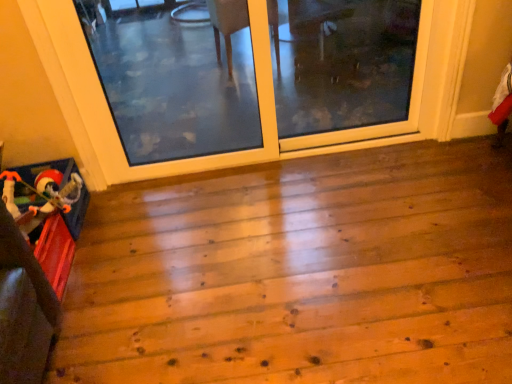
Describe the element at coordinates (23, 308) in the screenshot. I see `wooden toy at lower left` at that location.

Looking at this image, measure the distance between point (112, 179) and camera.

They are 7.84 feet apart.

Image resolution: width=512 pixels, height=384 pixels. In order to click on wooden toy at lower left in this screenshot , I will do `click(23, 308)`.

Is plush santa toy at lower left far from wooden toy at lower left?

That's not correct — plush santa toy at lower left is a little close to wooden toy at lower left.

From a real-world perspective, is plush santa toy at lower left physically located above or below wooden toy at lower left?

plush santa toy at lower left is above wooden toy at lower left.

How many degrees apart are the facing directions of plush santa toy at lower left and wooden toy at lower left?

0.47 degrees.

Can you confirm if plush santa toy at lower left is thinner than wooden toy at lower left?

No, plush santa toy at lower left is not thinner than wooden toy at lower left.

Is clear glass screen door at center, the 1th screen door when ordered from left to right, to the left of plush santa toy at lower left from the viewer's perspective?

Incorrect, clear glass screen door at center, the 1th screen door when ordered from left to right, is not on the left side of plush santa toy at lower left.

Based on the photo, is clear glass screen door at center, the 1th screen door when ordered from left to right, oriented towards plush santa toy at lower left?

No.

Considering the sizes of objects clear glass screen door at center, the 1th screen door when ordered from left to right, and plush santa toy at lower left in the image provided, who is thinner, clear glass screen door at center, the 1th screen door when ordered from left to right, or plush santa toy at lower left?

With smaller width is clear glass screen door at center, the 1th screen door when ordered from left to right.

Between plush santa toy at lower left and clear glass screen door at center, the 1th screen door when ordered from left to right, which one has larger width?

Wider between the two is plush santa toy at lower left.

Is plush santa toy at lower left spatially inside clear glass screen door at center, the 1th screen door when ordered from left to right, or outside of it?

plush santa toy at lower left is not inside clear glass screen door at center, the 1th screen door when ordered from left to right, it's outside.

Identify the location of toy that appears on the left of clear glass screen door at center, the 1th screen door when ordered from left to right. (45, 189).

Considering their positions, is plush santa toy at lower left located in front of or behind clear glass screen door at center, which is counted as the second screen door, starting from the right?

plush santa toy at lower left is positioned farther from the viewer than clear glass screen door at center, which is counted as the second screen door, starting from the right.

From the image's perspective, is transparent glass screen door at upper center, which is the first screen door in right-to-left order, located above or below clear glass screen door at center, the 1th screen door when ordered from left to right?

Based on their image positions, transparent glass screen door at upper center, which is the first screen door in right-to-left order, is located above clear glass screen door at center, the 1th screen door when ordered from left to right.

Is transparent glass screen door at upper center, which is the first screen door in right-to-left order, to the right of clear glass screen door at center, the 1th screen door when ordered from left to right, from the viewer's perspective?

Correct, you'll find transparent glass screen door at upper center, which is the first screen door in right-to-left order, to the right of clear glass screen door at center, the 1th screen door when ordered from left to right.

Is transparent glass screen door at upper center, which is the first screen door in right-to-left order, turned away from clear glass screen door at center, which is counted as the second screen door, starting from the right?

Yes, transparent glass screen door at upper center, which is the first screen door in right-to-left order, is positioned with its back facing clear glass screen door at center, which is counted as the second screen door, starting from the right.

Is there a large distance between transparent glass screen door at upper center, placed as the second screen door when sorted from left to right, and clear glass screen door at center, the 1th screen door when ordered from left to right?

transparent glass screen door at upper center, placed as the second screen door when sorted from left to right, is actually quite close to clear glass screen door at center, the 1th screen door when ordered from left to right.

From the image's perspective, which screen door is the 2nd one above the wooden toy at lower left? Please provide its 2D coordinates.

[(380, 124)]

From the image's perspective, is transparent glass screen door at upper center, which is the first screen door in right-to-left order, located above or below wooden toy at lower left?

transparent glass screen door at upper center, which is the first screen door in right-to-left order, is above wooden toy at lower left.

Considering the sizes of transparent glass screen door at upper center, which is the first screen door in right-to-left order, and wooden toy at lower left in the image, is transparent glass screen door at upper center, which is the first screen door in right-to-left order, wider or thinner than wooden toy at lower left?

Clearly, transparent glass screen door at upper center, which is the first screen door in right-to-left order, has less width compared to wooden toy at lower left.

Considering the positions of points (382, 125) and (2, 332), is point (382, 125) farther from camera compared to point (2, 332)?

Yes, it is.

In the image, there is a clear glass screen door at center, which is counted as the second screen door, starting from the right. What are the coordinates of `furniture below it (from a real-world perspective)` in the screenshot? It's located at (23, 308).

Measure the distance from wooden toy at lower left to clear glass screen door at center, the 1th screen door when ordered from left to right.

wooden toy at lower left is 1.21 meters away from clear glass screen door at center, the 1th screen door when ordered from left to right.

From the image's perspective, which one is positioned lower, wooden toy at lower left or clear glass screen door at center, the 1th screen door when ordered from left to right?

wooden toy at lower left appears lower in the image.

Is wooden toy at lower left wider or thinner than clear glass screen door at center, the 1th screen door when ordered from left to right?

Clearly, wooden toy at lower left has more width compared to clear glass screen door at center, the 1th screen door when ordered from left to right.

Is point (0, 225) behind point (412, 96)?

No, (0, 225) is closer to viewer.

Is transparent glass screen door at upper center, placed as the second screen door when sorted from left to right, completely or partially inside wooden toy at lower left?

No, transparent glass screen door at upper center, placed as the second screen door when sorted from left to right, is located outside of wooden toy at lower left.

Locate an element on the screen. This screenshot has height=384, width=512. furniture on the left of transparent glass screen door at upper center, which is the first screen door in right-to-left order is located at coordinates (23, 308).

Based on their sizes in the image, would you say wooden toy at lower left is bigger or smaller than transparent glass screen door at upper center, which is the first screen door in right-to-left order?

Clearly, wooden toy at lower left is smaller in size than transparent glass screen door at upper center, which is the first screen door in right-to-left order.

At what (x,y) coordinates should I click in order to perform the action: click on toy that is above the wooden toy at lower left (from a real-world perspective). Please return your answer as a coordinate pair (x, y). The image size is (512, 384). Looking at the image, I should click on (45, 189).

At what (x,y) coordinates should I click in order to perform the action: click on toy below the clear glass screen door at center, the 1th screen door when ordered from left to right (from a real-world perspective). Please return your answer as a coordinate pair (x, y). This screenshot has width=512, height=384. Looking at the image, I should click on (45, 189).

Looking at the image, which one is located closer to wooden toy at lower left, clear glass screen door at center, the 1th screen door when ordered from left to right, or transparent glass screen door at upper center, placed as the second screen door when sorted from left to right?

clear glass screen door at center, the 1th screen door when ordered from left to right, lies closer to wooden toy at lower left than the other object.

Consider the image. From the image, which object appears to be farther from wooden toy at lower left, plush santa toy at lower left or clear glass screen door at center, the 1th screen door when ordered from left to right?

clear glass screen door at center, the 1th screen door when ordered from left to right, is further to wooden toy at lower left.

Looking at the image, which one is located further to transparent glass screen door at upper center, which is the first screen door in right-to-left order, plush santa toy at lower left or clear glass screen door at center, which is counted as the second screen door, starting from the right?

plush santa toy at lower left.

From the image, which object appears to be farther from clear glass screen door at center, the 1th screen door when ordered from left to right, transparent glass screen door at upper center, placed as the second screen door when sorted from left to right, or wooden toy at lower left?

wooden toy at lower left is positioned further to the anchor clear glass screen door at center, the 1th screen door when ordered from left to right.

Estimate the real-world distances between objects in this image. Which object is closer to plush santa toy at lower left, clear glass screen door at center, which is counted as the second screen door, starting from the right, or transparent glass screen door at upper center, which is the first screen door in right-to-left order?

clear glass screen door at center, which is counted as the second screen door, starting from the right, is closer to plush santa toy at lower left.

Estimate the real-world distances between objects in this image. Which object is closer to wooden toy at lower left, transparent glass screen door at upper center, placed as the second screen door when sorted from left to right, or clear glass screen door at center, the 1th screen door when ordered from left to right?

clear glass screen door at center, the 1th screen door when ordered from left to right.

Considering their positions, is clear glass screen door at center, which is counted as the second screen door, starting from the right, positioned further to plush santa toy at lower left than wooden toy at lower left?

Among the two, clear glass screen door at center, which is counted as the second screen door, starting from the right, is located further to plush santa toy at lower left.

Considering their positions, is wooden toy at lower left positioned further to clear glass screen door at center, which is counted as the second screen door, starting from the right, than transparent glass screen door at upper center, placed as the second screen door when sorted from left to right?

The object further to clear glass screen door at center, which is counted as the second screen door, starting from the right, is wooden toy at lower left.

Identify the location of furniture located between plush santa toy at lower left and transparent glass screen door at upper center, placed as the second screen door when sorted from left to right, in the left-right direction. (23, 308).

Identify the location of furniture between plush santa toy at lower left and clear glass screen door at center, the 1th screen door when ordered from left to right. (23, 308).

Find the location of a particular element. screen door between plush santa toy at lower left and transparent glass screen door at upper center, placed as the second screen door when sorted from left to right, in the horizontal direction is located at coordinates (274, 101).

What are the coordinates of `screen door between wooden toy at lower left and transparent glass screen door at upper center, placed as the second screen door when sorted from left to right, in the horizontal direction` in the screenshot? It's located at (274, 101).